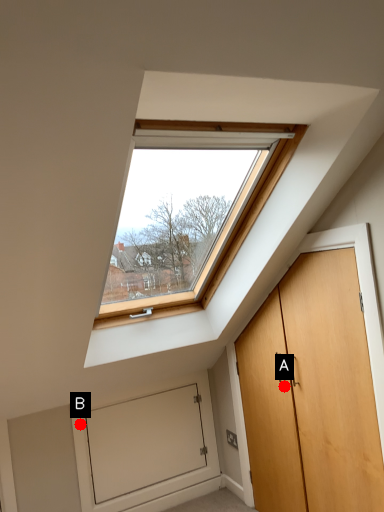
Question: Two points are circled on the image, labeled by A and B beside each circle. Which point is further to the camera?

Choices:
 (A) A is further
 (B) B is further

Answer: (B)